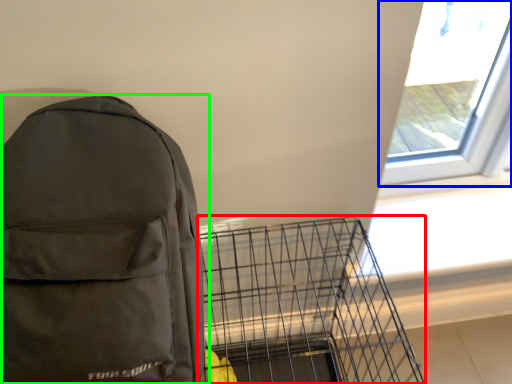
Question: Which object is positioned closest to bird cage (highlighted by a red box)? Select from window (highlighted by a blue box) and backpack (highlighted by a green box).

Choices:
 (A) window
 (B) backpack

Answer: (B)